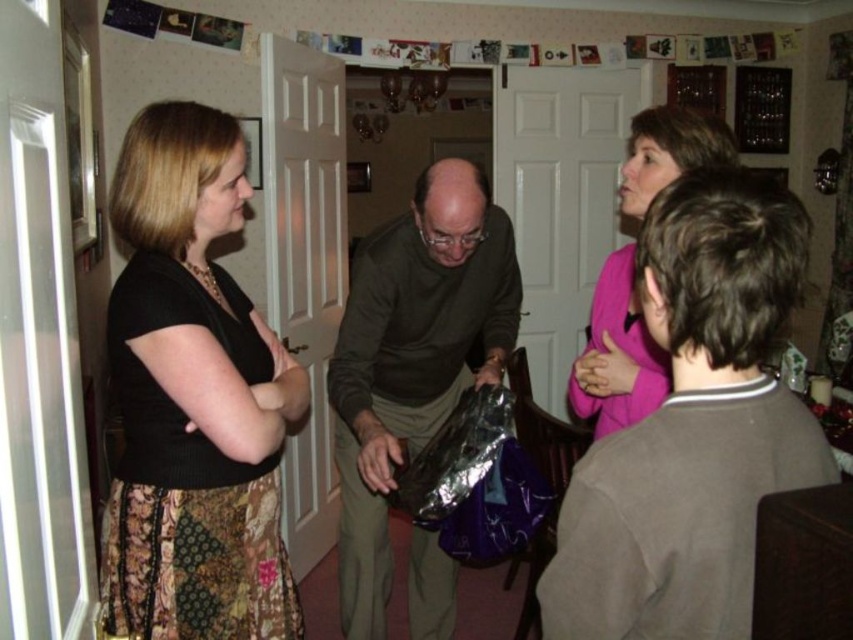
You are trying to decide which sweater to take for a casual outing. Both the matte green sweater at center and the pink matte sweater at upper right are options. Based on their sizes, which one might you choose if you prefer a wider fit?

The matte green sweater at center might be wider than the pink matte sweater at upper right, so if you prefer a wider fit, you might choose the matte green sweater at center.

You are trying to decide which sweater to take for a cold day. The black textured sweater at left and the matte green sweater at center are both options. Based on their thickness, which one would provide better insulation?

The matte green sweater at center is thicker than the black textured sweater at left, so it would provide better insulation.

Based on the scene description, where is the matte green sweater at center located in terms of its 2D coordinates?

The matte green sweater at center is located at the 2D coordinates point (412, 356).